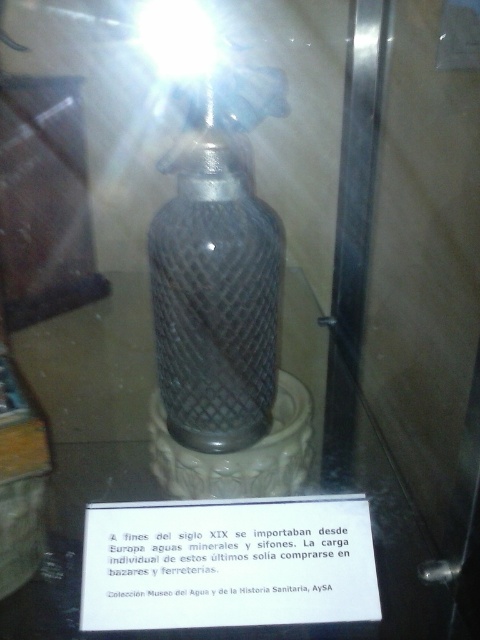
You are a security guard in a museum. You see the metallic mesh bottle at center and the white paper at center in a display case. Which object is closer to the ceiling?

The metallic mesh bottle at center is closer to the ceiling because it is above the white paper at center in the display case.

You are a museum curator arranging items in a display case. You have a metallic mesh bottle at center and a white paper at center. Which item should you place higher to ensure both are visible to visitors?

The metallic mesh bottle at center is taller than the white paper at center, so you should place the white paper at center higher to avoid being blocked by the metallic mesh bottle at center.

You are an art curator arranging items in a display case. You have a metallic mesh bottle at center and a white paper at center. Which object is narrower?

The metallic mesh bottle at center is narrower than the white paper at center.